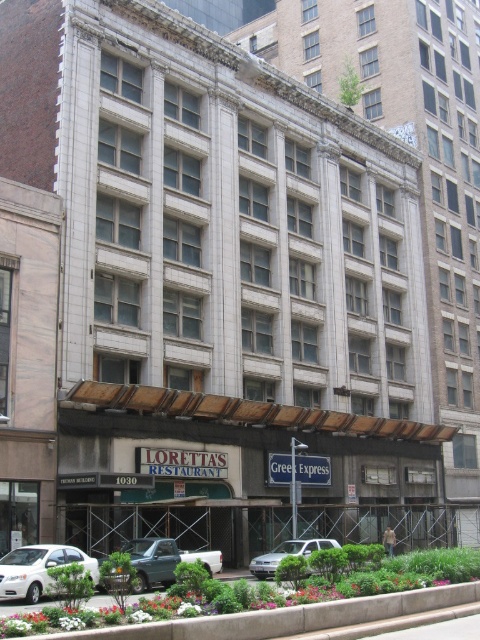
Question: Which object is the farthest from the green metallic truck at lower center?

Choices:
 (A) silver metallic sedan at center
 (B) green grass at lower center

Answer: (A)

Question: Does green grass at lower center appear under white matte sedan at lower left?

Choices:
 (A) yes
 (B) no

Answer: (A)

Question: Is green grass at lower center further to camera compared to silver metallic sedan at center?

Choices:
 (A) no
 (B) yes

Answer: (A)

Question: Which of the following is the farthest from the observer?

Choices:
 (A) (262, 573)
 (B) (254, 608)
 (C) (35, 547)
 (D) (166, 561)

Answer: (A)

Question: Which point is farther from the camera taking this photo?

Choices:
 (A) (277, 557)
 (B) (39, 556)
 (C) (354, 588)
 (D) (158, 557)

Answer: (A)

Question: Is white matte sedan at lower left positioned behind silver metallic sedan at center?

Choices:
 (A) no
 (B) yes

Answer: (A)